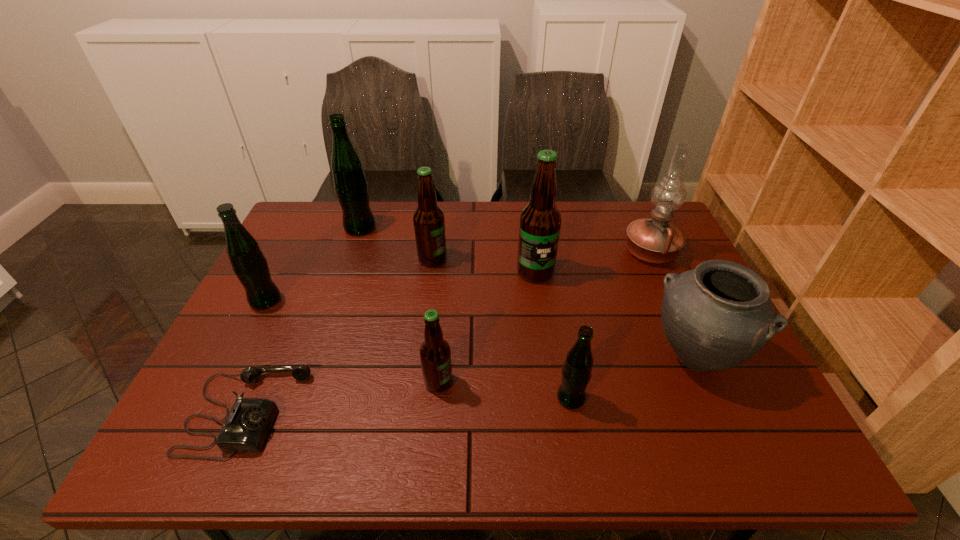
Identify the location of the nearest green beer bottle. (577, 370).

This screenshot has width=960, height=540. I want to click on the shortest object, so click(x=248, y=423).

Where is `free space located 0.060m on the front of the farthest beer bottle`? free space located 0.060m on the front of the farthest beer bottle is located at coordinates (353, 249).

The width and height of the screenshot is (960, 540). I want to click on vacant area situated on the label of the biggest brown beer bottle, so click(540, 310).

Identify the location of blank area located on the front of the oil lamp. (676, 307).

Where is `vacant space located on the label of the second biggest brown beer bottle`? This screenshot has width=960, height=540. vacant space located on the label of the second biggest brown beer bottle is located at coordinates (576, 259).

Image resolution: width=960 pixels, height=540 pixels. I want to click on vacant space located on the back of the second nearest green beer bottle, so click(x=303, y=225).

Where is `free space located 0.150m on the back of the black urn`? This screenshot has height=540, width=960. free space located 0.150m on the back of the black urn is located at coordinates (661, 283).

Identify the location of vacant point located 0.300m on the label of the nearest brown beer bottle. The height and width of the screenshot is (540, 960). (584, 382).

You are a GUI agent. You are given a task and a screenshot of the screen. Output one action in this format:
    pyautogui.click(x=<x>, y=<y>)
    Task: Click on the vacant area located 0.350m on the left of the smallest green beer bottle
    
    Given the screenshot: What is the action you would take?
    pyautogui.click(x=398, y=398)